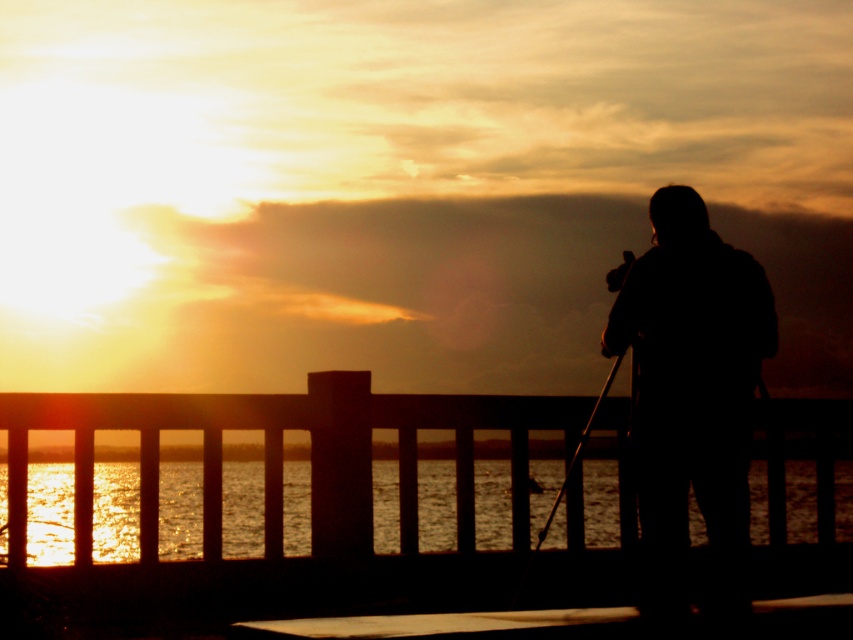
You are a photographer trying to set up your equipment on the smooth wooden dock at lower center. You have a metallic tripod at right that you need to place on the dock. Considering the dock is shorter than the tripod, will the tripod fit entirely on the dock without any part hanging off?

The smooth wooden dock at lower center is shorter than the metallic tripod at right, so the tripod will not fit entirely on the dock without part of it hanging off.

You are standing behind the wooden railing in the sunset scene. You notice two points marked in the image. The first point is at coordinates point (585,538) and the second is at point (781,637). Which of these two points is closer to you?

Point (781,637) is closer to you because it is in front of point (585,538).

You are standing behind the wooden railing and want to take a photo of the sunset. The glistening water at lower center and the smooth wooden dock at lower center are both in your view. Which object is closer to the camera?

The glistening water at lower center is located above the smooth wooden dock at lower center, so the glistening water at lower center is closer to the camera.